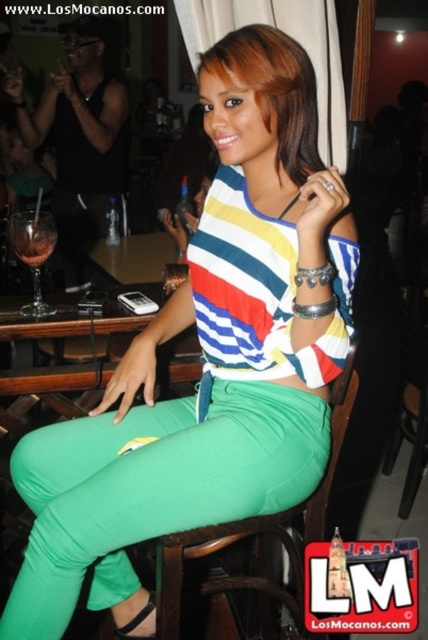
Question: Which of these objects is positioned farthest from the translucent glass wine at left?

Choices:
 (A) green fabric pants at center
 (B) green fabric chair at center

Answer: (B)

Question: Is green fabric chair at center to the right of translucent glass wine at left from the viewer's perspective?

Choices:
 (A) no
 (B) yes

Answer: (B)

Question: Estimate the real-world distances between objects in this image. Which object is closer to the green fabric pants at center?

Choices:
 (A) translucent glass wine at left
 (B) green fabric chair at center

Answer: (B)

Question: Does green fabric pants at center appear on the left side of green fabric chair at center?

Choices:
 (A) yes
 (B) no

Answer: (A)

Question: Does green fabric chair at center appear on the right side of translucent glass wine at left?

Choices:
 (A) yes
 (B) no

Answer: (A)

Question: Among these points, which one is farthest from the camera?

Choices:
 (A) (17, 227)
 (B) (214, 540)
 (C) (262, 394)

Answer: (A)